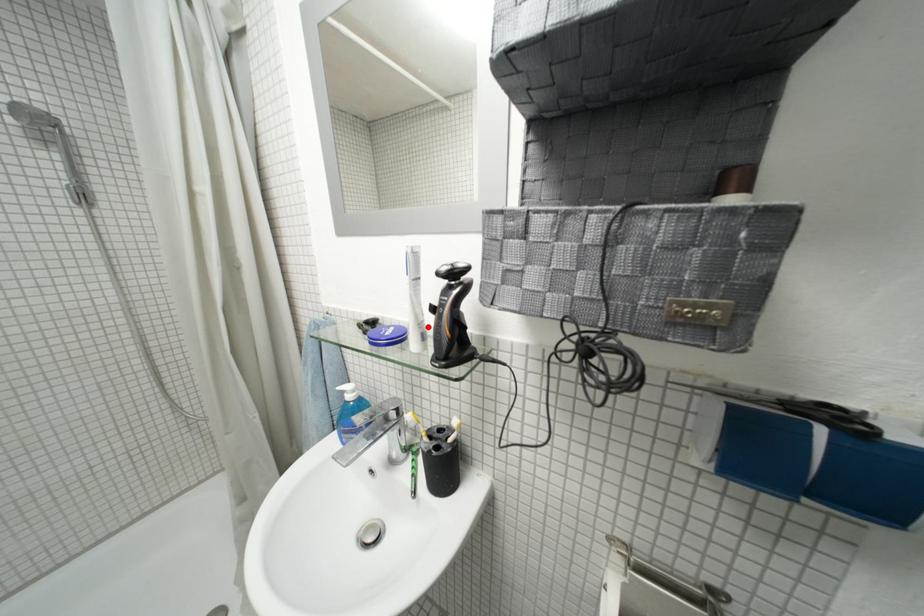
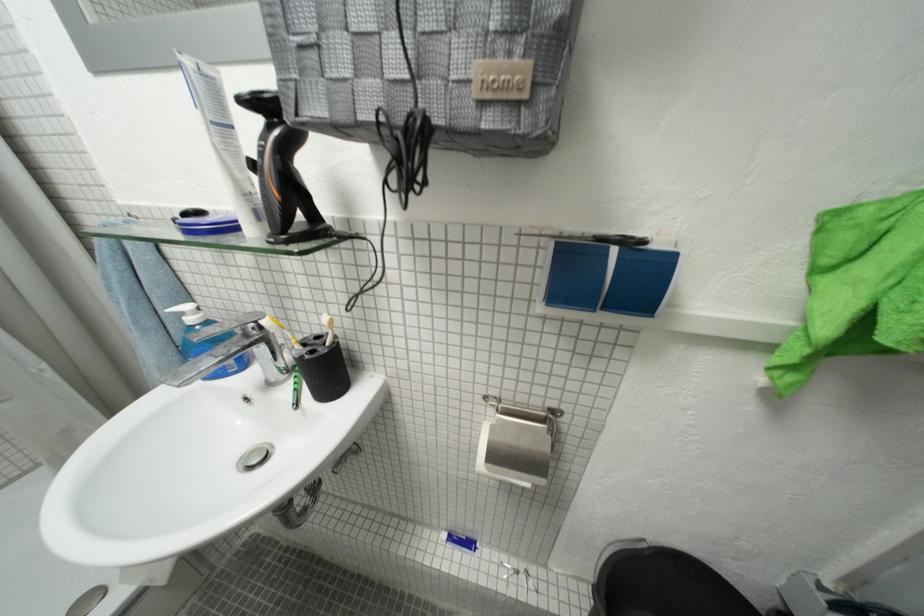
Find the pixel in the second image that matches the highlighted location in the first image.

(252, 197)